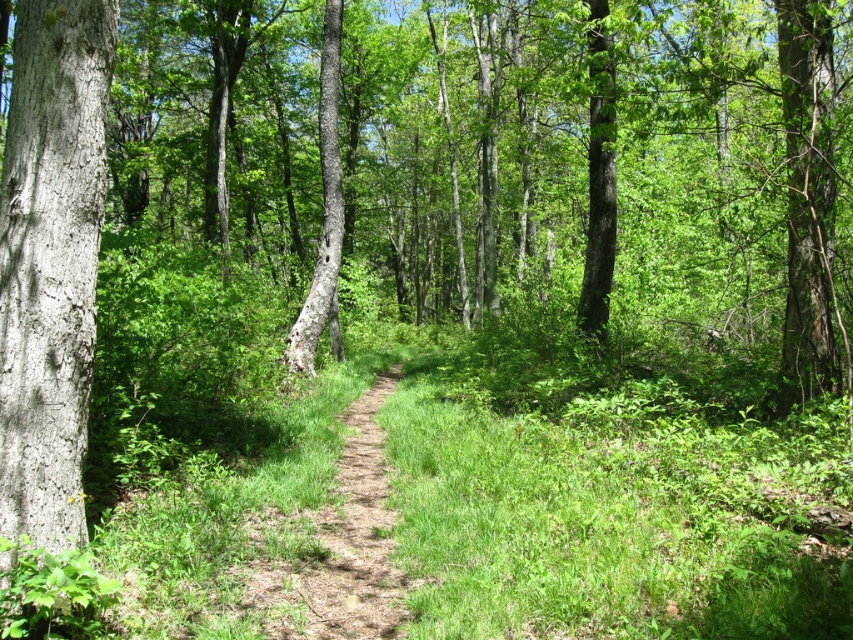
Looking at this image, you are standing on the dirt path in the center of the forest scene. You notice a point marked at coordinates [50,301]. What can you find at that location?

At the point marked at coordinates [50,301], you can find smooth gray bark at left.

You are standing at the starting point of the dirt path in the forest. You want to reach the point marked as point (357, 536). Which direction should you walk along the dirt path to reach that point?

The point (357, 536) corresponds to the brown dirt path at center, so you should walk straight along the dirt path towards the center of the forest to reach that point.